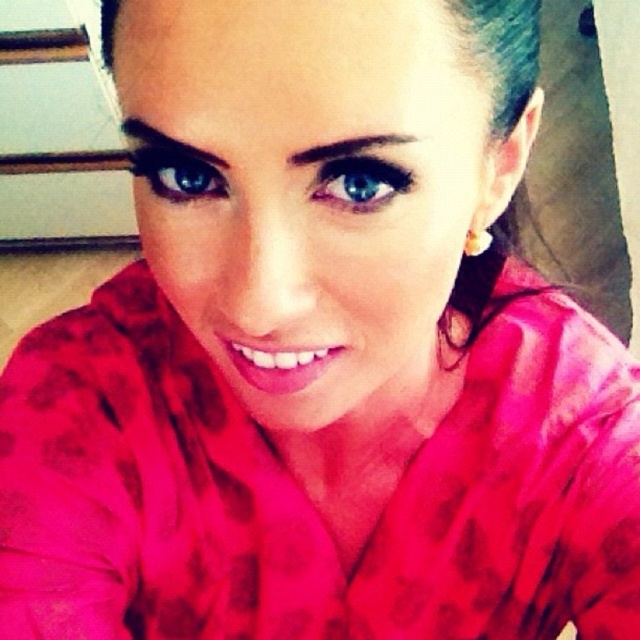
Question: Does blue glossy eye at center appear on the left side of blue glossy eye at upper center?

Choices:
 (A) yes
 (B) no

Answer: (B)

Question: Is blue glossy eye at center in front of blue glossy eye at upper center?

Choices:
 (A) no
 (B) yes

Answer: (B)

Question: Among these objects, which one is farthest from the camera?

Choices:
 (A) blue glossy eye at upper center
 (B) blue glossy eye at center

Answer: (A)

Question: Does blue glossy eye at center have a greater width compared to blue glossy eye at upper center?

Choices:
 (A) no
 (B) yes

Answer: (A)